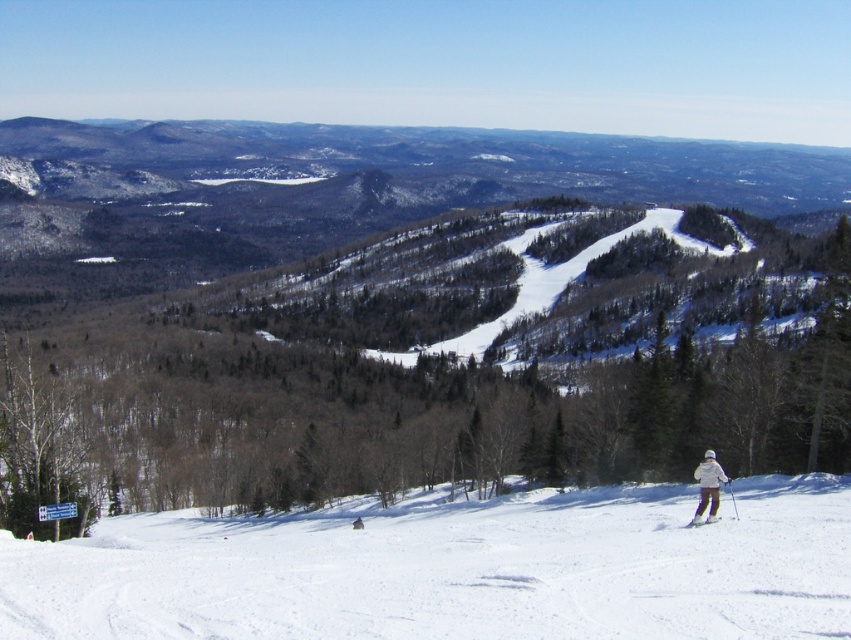
Question: Is white powdery snow at lower center in front of white matte ski at lower right?

Choices:
 (A) no
 (B) yes

Answer: (B)

Question: Observing the image, what is the correct spatial positioning of white powdery snow at lower center in reference to white matte jacket at lower right?

Choices:
 (A) left
 (B) right

Answer: (A)

Question: Which object is farther from the camera taking this photo?

Choices:
 (A) white powdery snow at lower center
 (B) white matte ski at lower right
 (C) white matte jacket at lower right

Answer: (B)

Question: Which object is positioned closest to the white powdery snow at lower center?

Choices:
 (A) white matte jacket at lower right
 (B) white matte ski at lower right

Answer: (A)

Question: In this image, where is white powdery snow at lower center located relative to white matte jacket at lower right?

Choices:
 (A) left
 (B) right

Answer: (A)

Question: Among these points, which one is nearest to the camera?

Choices:
 (A) (695, 516)
 (B) (678, 627)
 (C) (718, 492)

Answer: (B)